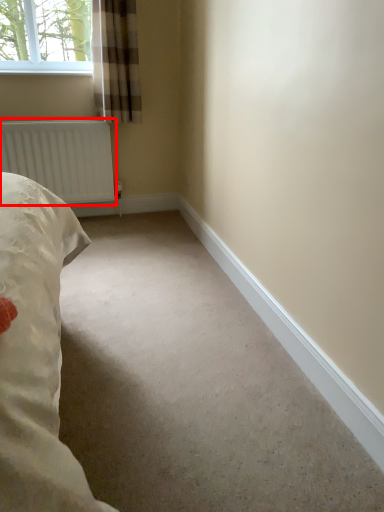
Question: From the image's perspective, what is the correct spatial relationship of radiator (annotated by the red box) in relation to curtain?

Choices:
 (A) below
 (B) above

Answer: (A)